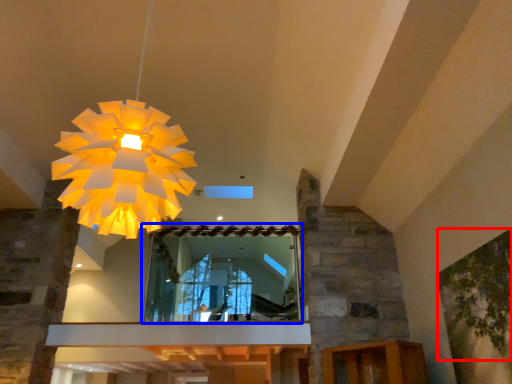
Question: Among these objects, which one is farthest to the camera, tree (highlighted by a red box) or mirror (highlighted by a blue box)?

Choices:
 (A) tree
 (B) mirror

Answer: (B)